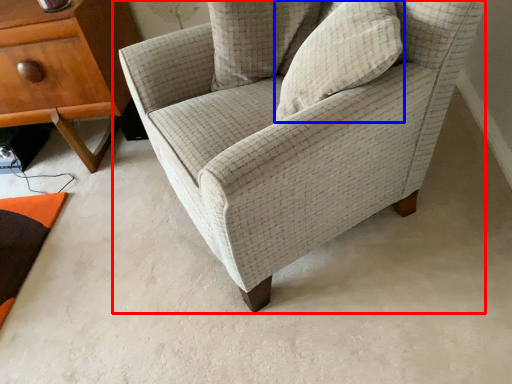
Question: Which of the following is the closest to the observer, chair (highlighted by a red box) or pillow (highlighted by a blue box)?

Choices:
 (A) chair
 (B) pillow

Answer: (A)